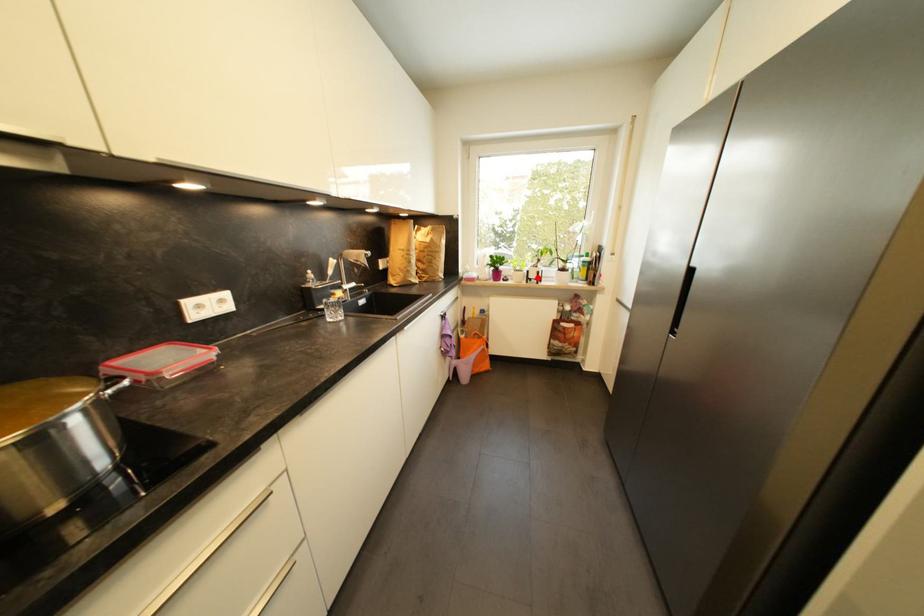
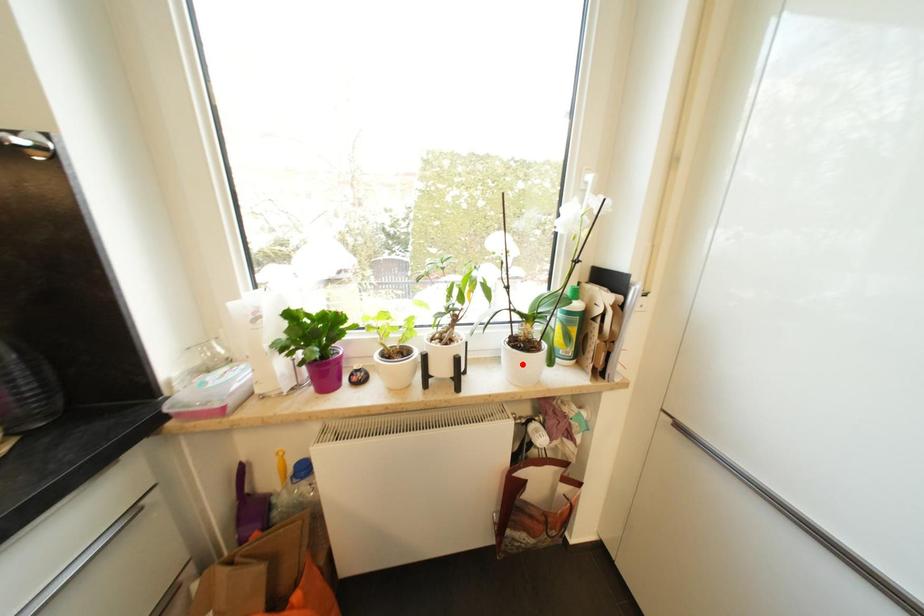
I am providing you with two images of the same scene from different viewpoints. A red point is marked on the first image and another point is marked on the second image. Does the point marked in image1 correspond to the same location as the one in image2?

No